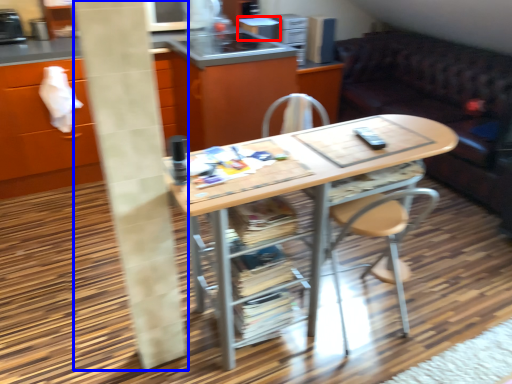
Question: Which object is closer to the camera taking this photo, appliance (highlighted by a red box) or pillar (highlighted by a blue box)?

Choices:
 (A) appliance
 (B) pillar

Answer: (B)